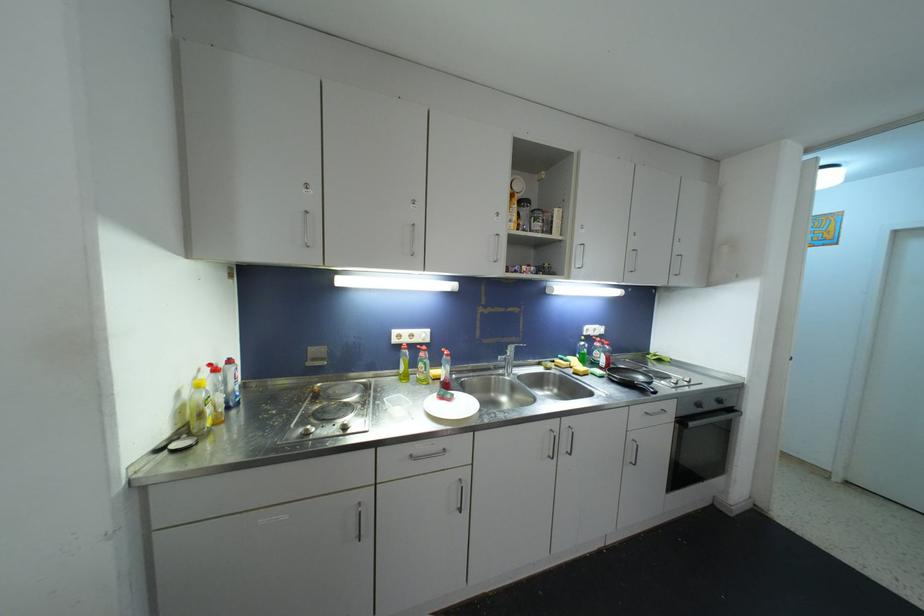
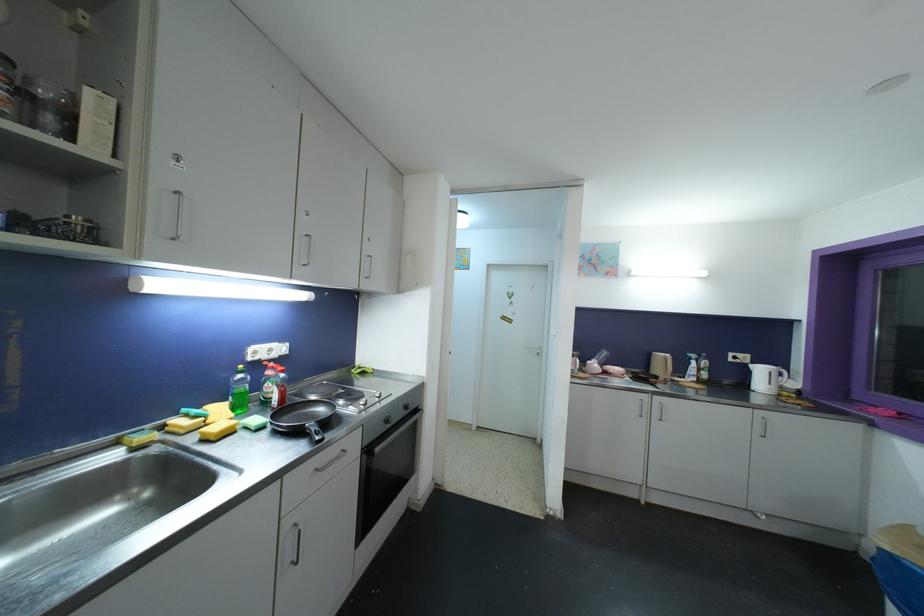
Where in the second image is the point corresponding to point (611, 347) from the first image?

(286, 374)